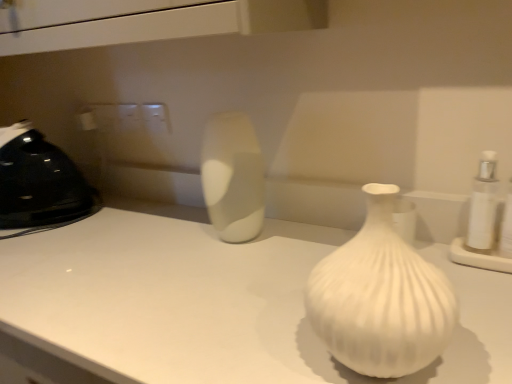
The image size is (512, 384). What are the coordinates of `vacant area situated to the left side of satin white vase at center, the first vase from the back` in the screenshot? It's located at (172, 243).